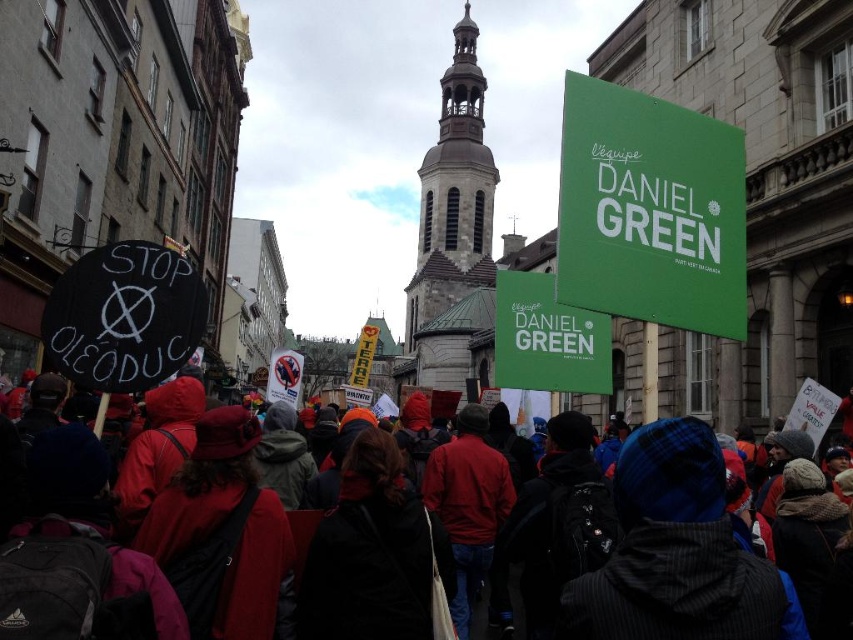
Question: Considering the real-world distances, which object is closest to the green matte sign at upper right?

Choices:
 (A) red fabric crowd at center
 (B) green matte sign at upper center

Answer: (B)

Question: Where is green matte sign at upper center located in relation to green matte sign at upper right in the image?

Choices:
 (A) right
 (B) left

Answer: (A)

Question: Which point is closer to the camera taking this photo?

Choices:
 (A) (578, 321)
 (B) (564, 244)

Answer: (B)

Question: Among these points, which one is farthest from the camera?

Choices:
 (A) (709, 168)
 (B) (521, 348)
 (C) (792, 616)

Answer: (B)

Question: Observing the image, what is the correct spatial positioning of red fabric crowd at center in reference to green matte sign at upper right?

Choices:
 (A) left
 (B) right

Answer: (A)

Question: Is the position of red fabric crowd at center more distant than that of green matte sign at upper center?

Choices:
 (A) no
 (B) yes

Answer: (A)